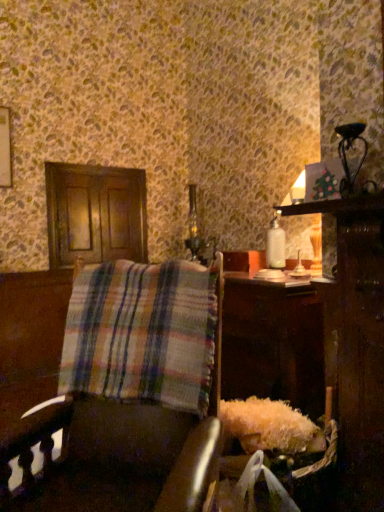
Question: Is plaid fabric chair at center a part of plaid fabric at left?

Choices:
 (A) no
 (B) yes

Answer: (A)

Question: Is plaid fabric at left outside of plaid fabric chair at center?

Choices:
 (A) no
 (B) yes

Answer: (A)

Question: From a real-world perspective, is plaid fabric at left physically below plaid fabric chair at center?

Choices:
 (A) yes
 (B) no

Answer: (B)

Question: Is plaid fabric at left wider than plaid fabric chair at center?

Choices:
 (A) no
 (B) yes

Answer: (A)

Question: Considering the relative sizes of plaid fabric at left and plaid fabric chair at center in the image provided, is plaid fabric at left smaller than plaid fabric chair at center?

Choices:
 (A) yes
 (B) no

Answer: (A)

Question: Does plaid fabric at left come behind plaid fabric chair at center?

Choices:
 (A) no
 (B) yes

Answer: (B)

Question: Considering the relative positions of metallic silver table lamp at upper right and plaid fabric at left in the image provided, is metallic silver table lamp at upper right to the right of plaid fabric at left from the viewer's perspective?

Choices:
 (A) no
 (B) yes

Answer: (B)

Question: From a real-world perspective, is metallic silver table lamp at upper right positioned over plaid fabric at left based on gravity?

Choices:
 (A) no
 (B) yes

Answer: (B)

Question: Would you say metallic silver table lamp at upper right is a long distance from plaid fabric at left?

Choices:
 (A) no
 (B) yes

Answer: (A)

Question: Considering the relative positions of metallic silver table lamp at upper right and plaid fabric at left in the image provided, is metallic silver table lamp at upper right to the left of plaid fabric at left from the viewer's perspective?

Choices:
 (A) yes
 (B) no

Answer: (B)

Question: Could you tell me if metallic silver table lamp at upper right is turned towards plaid fabric at left?

Choices:
 (A) yes
 (B) no

Answer: (B)

Question: Does metallic silver table lamp at upper right have a larger size compared to plaid fabric at left?

Choices:
 (A) no
 (B) yes

Answer: (A)

Question: Considering the relative sizes of metallic silver table lamp at upper right and plaid fabric chair at center in the image provided, is metallic silver table lamp at upper right bigger than plaid fabric chair at center?

Choices:
 (A) yes
 (B) no

Answer: (B)